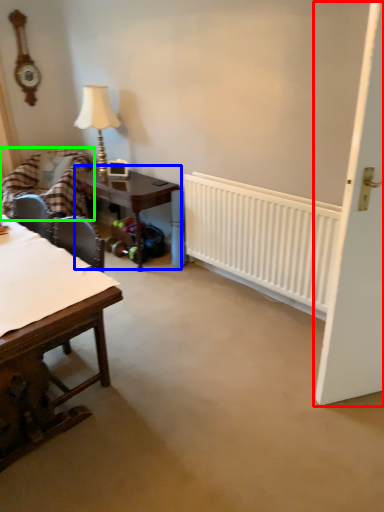
Question: Which is nearer to the door (highlighted by a red box)? table (highlighted by a blue box) or chair (highlighted by a green box).

Choices:
 (A) table
 (B) chair

Answer: (A)